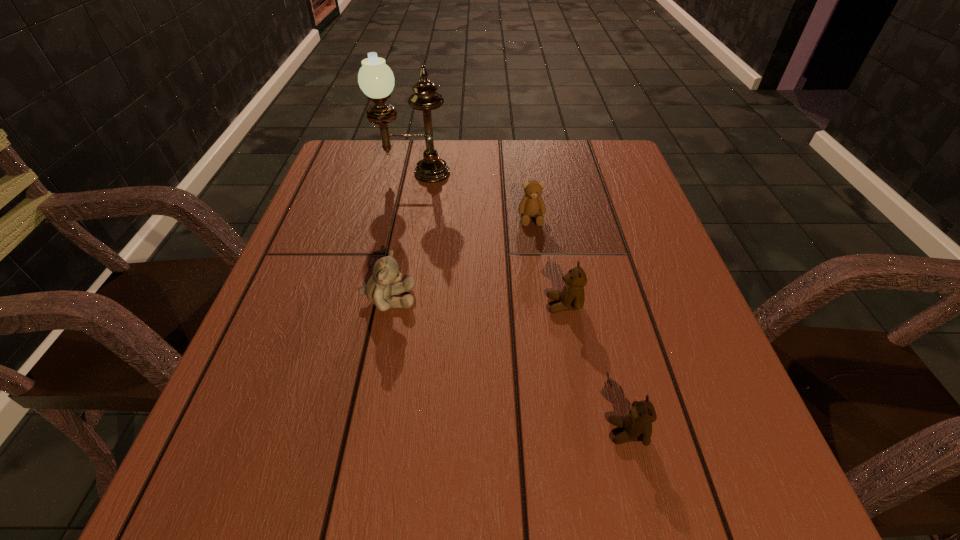
Identify which object is the second nearest to the nearest object. Please provide its 2D coordinates. Your answer should be formatted as a tuple, i.e. [(x, y)], where the tuple contains the x and y coordinates of a point satisfying the conditions above.

[(384, 282)]

Where is `the closest teddy bear to the farthest object`? This screenshot has width=960, height=540. the closest teddy bear to the farthest object is located at coordinates (532, 204).

You are a GUI agent. You are given a task and a screenshot of the screen. Output one action in this format:
    pyautogui.click(x=<x>, y=<y>)
    Task: Click on the closest teddy bear to the oil lamp
    This screenshot has height=540, width=960.
    Given the screenshot: What is the action you would take?
    pyautogui.click(x=532, y=204)